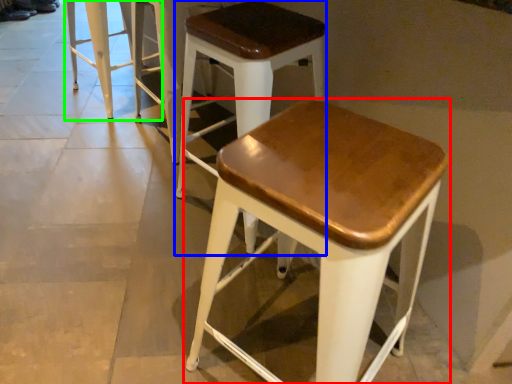
Question: Which object is the closest to the stool (highlighted by a red box)? Choose among these: stool (highlighted by a blue box) or stool (highlighted by a green box).

Choices:
 (A) stool
 (B) stool

Answer: (A)